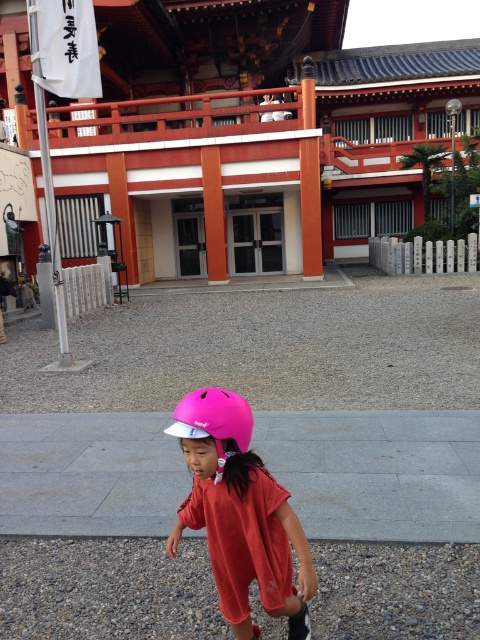
You are standing at point (192, 397) and want to move to the building in the background. Is the point (240, 467) between you and the building?

Yes, the point (240, 467) is between you and the building because it is behind point (192, 397), which is your current position.

You are a parent trying to ensure your child is safe. You see two pink matte helmets in the scene. How far apart are the pink matte helmet at center and the pink matte helmet at lower center?

The pink matte helmet at center is 12.01 inches away from the pink matte helmet at lower center.